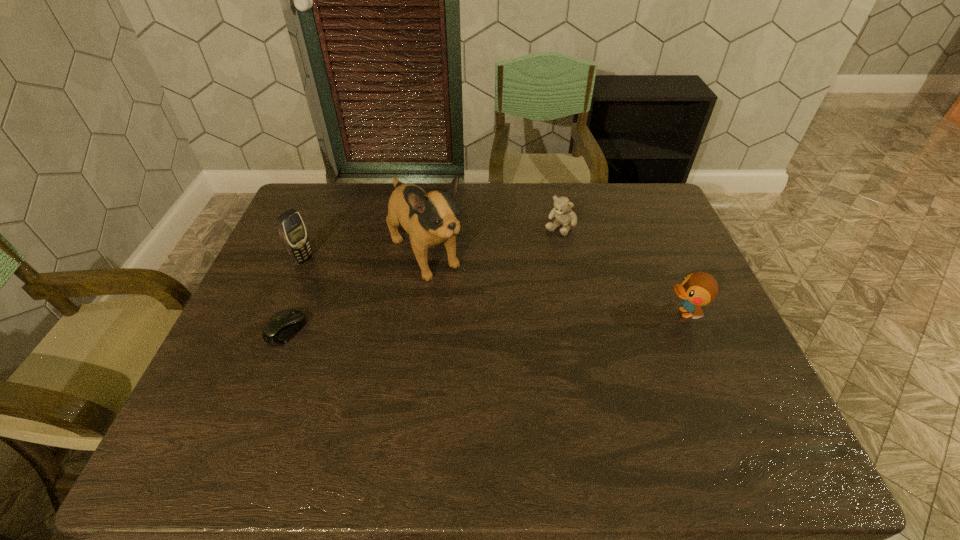
Find the location of `vacant space located 0.160m on the front-facing side of the rightmost object`. vacant space located 0.160m on the front-facing side of the rightmost object is located at coordinates (602, 313).

The height and width of the screenshot is (540, 960). Find the location of `free space located on the front-facing side of the rightmost object`. free space located on the front-facing side of the rightmost object is located at coordinates (567, 313).

Locate an element on the screen. vacant space situated on the front face of the cellular telephone is located at coordinates (389, 302).

At what (x,y) coordinates should I click in order to perform the action: click on free space located 0.120m on the front face of the cellular telephone. Please return your answer as a coordinate pair (x, y). The width and height of the screenshot is (960, 540). Looking at the image, I should click on (341, 279).

The image size is (960, 540). Find the location of `blank space located 0.130m on the front face of the cellular telephone`. blank space located 0.130m on the front face of the cellular telephone is located at coordinates (344, 280).

You are a GUI agent. You are given a task and a screenshot of the screen. Output one action in this format:
    pyautogui.click(x=<x>, y=<y>)
    Task: Click on the vacant space located 0.110m at the face of the puppy
    
    Given the screenshot: What is the action you would take?
    pyautogui.click(x=466, y=309)

This screenshot has height=540, width=960. Find the location of `free point located 0.050m at the face of the puppy`. free point located 0.050m at the face of the puppy is located at coordinates click(x=454, y=295).

Image resolution: width=960 pixels, height=540 pixels. I want to click on vacant space located at the face of the puppy, so coord(504,354).

Where is `vacant space located on the face of the second object from right to left`? This screenshot has width=960, height=540. vacant space located on the face of the second object from right to left is located at coordinates (504, 299).

This screenshot has height=540, width=960. I want to click on vacant area situated 0.080m on the face of the second object from right to left, so click(x=541, y=251).